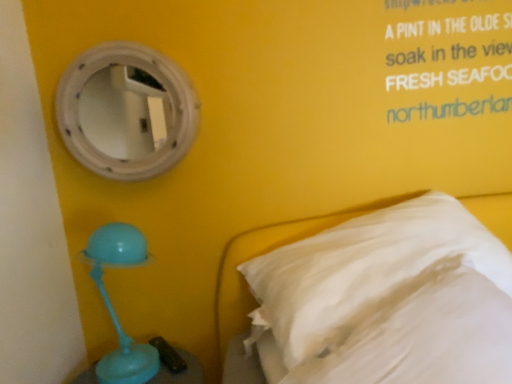
Question: Is white wooden mirror at upper left smaller than white soft pillow at right?

Choices:
 (A) no
 (B) yes

Answer: (B)

Question: Is white wooden mirror at upper left behind white soft pillow at right?

Choices:
 (A) no
 (B) yes

Answer: (B)

Question: Does white wooden mirror at upper left have a lesser height compared to white soft pillow at right?

Choices:
 (A) no
 (B) yes

Answer: (B)

Question: Is white wooden mirror at upper left to the right of white soft pillow at right from the viewer's perspective?

Choices:
 (A) no
 (B) yes

Answer: (A)

Question: Could you tell me if white wooden mirror at upper left is turned towards white soft pillow at right?

Choices:
 (A) yes
 (B) no

Answer: (B)

Question: Can you confirm if white wooden mirror at upper left is wider than white soft pillow at right?

Choices:
 (A) yes
 (B) no

Answer: (B)

Question: Is white soft pillow at right taller than white wooden mirror at upper left?

Choices:
 (A) yes
 (B) no

Answer: (A)

Question: From the image's perspective, does white soft pillow at right appear lower than white wooden mirror at upper left?

Choices:
 (A) yes
 (B) no

Answer: (A)

Question: Considering the relative positions of white soft pillow at right and white wooden mirror at upper left in the image provided, is white soft pillow at right to the right of white wooden mirror at upper left from the viewer's perspective?

Choices:
 (A) no
 (B) yes

Answer: (B)

Question: Is white soft pillow at right closer to camera compared to white wooden mirror at upper left?

Choices:
 (A) yes
 (B) no

Answer: (A)

Question: Is white soft pillow at right directly adjacent to white wooden mirror at upper left?

Choices:
 (A) yes
 (B) no

Answer: (B)

Question: Is white wooden mirror at upper left located within white soft pillow at right?

Choices:
 (A) no
 (B) yes

Answer: (A)

Question: Based on their sizes in the image, would you say white soft pillow at right is bigger or smaller than white wooden mirror at upper left?

Choices:
 (A) small
 (B) big

Answer: (B)